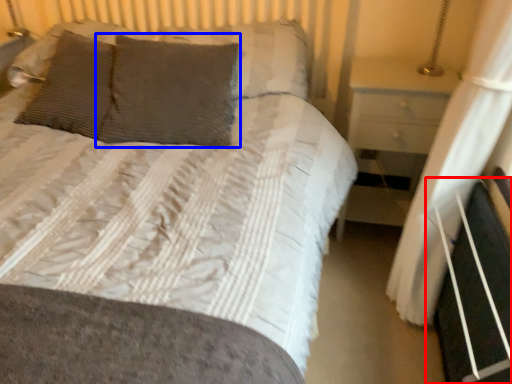
Question: Which of the following is the farthest to the observer, bed frame (highlighted by a red box) or pillow (highlighted by a blue box)?

Choices:
 (A) bed frame
 (B) pillow

Answer: (B)